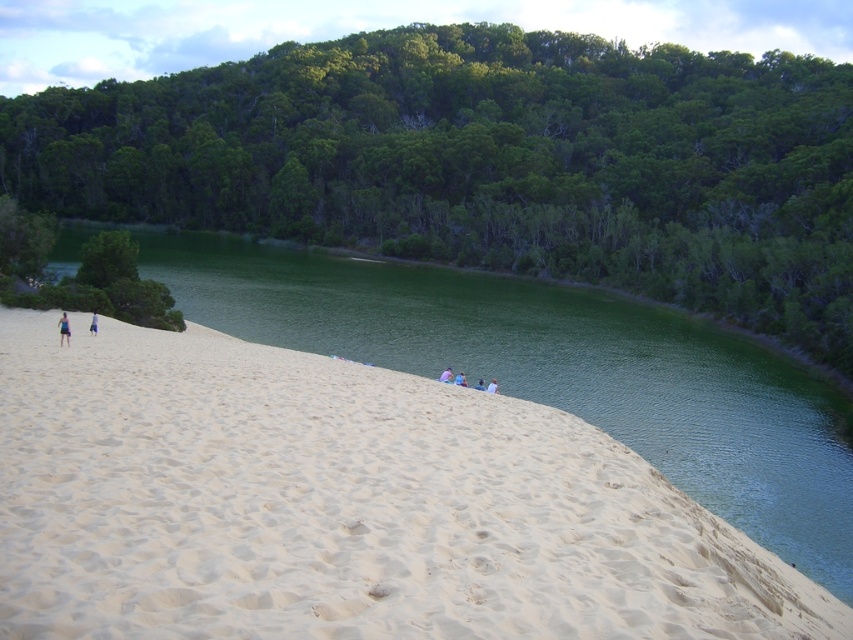
In the scene shown: Does white fabric person at lower center have a larger size compared to light brown fabric shirt at center?

Indeed, white fabric person at lower center has a larger size compared to light brown fabric shirt at center.

Is point (494, 387) positioned in front of point (483, 387)?

No, (494, 387) is behind (483, 387).

Where is `white fabric person at lower center`? Image resolution: width=853 pixels, height=640 pixels. white fabric person at lower center is located at coordinates (492, 387).

I want to click on white fabric person at lower center, so click(492, 387).

Can you confirm if light blue fabric at lower left is positioned to the left of light blue fabric at left?

Correct, you'll find light blue fabric at lower left to the left of light blue fabric at left.

Is light blue fabric at lower left wider than light blue fabric at left?

Indeed, light blue fabric at lower left has a greater width compared to light blue fabric at left.

Is point (62, 333) closer to camera compared to point (93, 326)?

That is True.

Find the location of `light blue fabric at lower left`. light blue fabric at lower left is located at coordinates (62, 330).

Is light blue fabric at left wider than white fabric person at lower center?

Indeed, light blue fabric at left has a greater width compared to white fabric person at lower center.

Who is shorter, light blue fabric at left or white fabric person at lower center?

A: white fabric person at lower center is shorter.

I want to click on light blue fabric at left, so click(x=93, y=324).